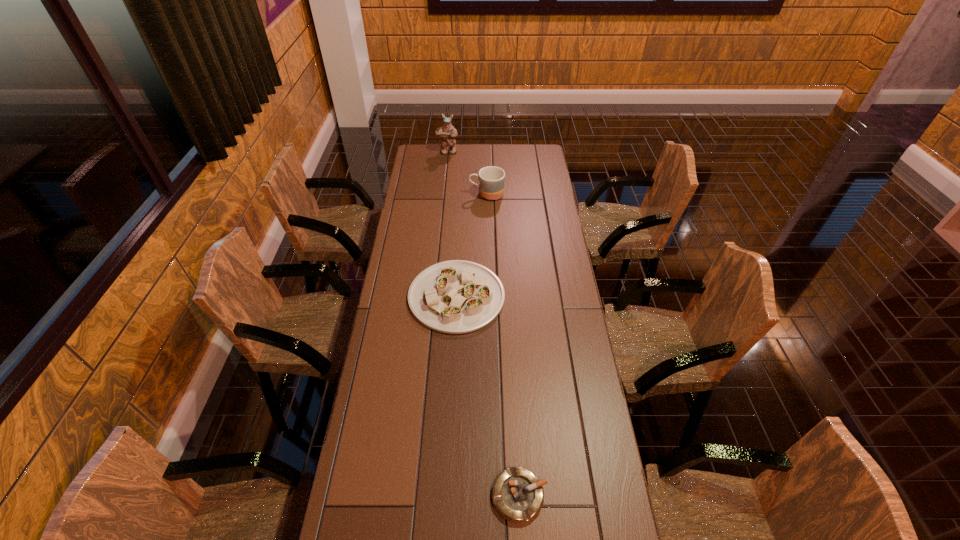
Identify the location of free location located 0.210m on the side with the handle of the mug. (426, 194).

At what (x,y) coordinates should I click in order to perform the action: click on free space located 0.070m on the side with the handle of the mug. Please return your answer as a coordinate pair (x, y). This screenshot has height=540, width=960. Looking at the image, I should click on (454, 194).

Where is `vacant space located on the back of the second nearest object`? The width and height of the screenshot is (960, 540). vacant space located on the back of the second nearest object is located at coordinates (461, 213).

Where is `vacant space situated 0.360m on the back of the shortest object`? vacant space situated 0.360m on the back of the shortest object is located at coordinates (512, 362).

Identify the location of object located in the far edge section of the desktop. The image size is (960, 540). (448, 133).

This screenshot has width=960, height=540. I want to click on figurine positioned at the left edge, so click(448, 133).

At what (x,y) coordinates should I click in order to perform the action: click on platter present at the left edge. Please return your answer as a coordinate pair (x, y). This screenshot has height=540, width=960. Looking at the image, I should click on (456, 296).

Locate an element on the screen. This screenshot has height=540, width=960. object at the far left corner is located at coordinates (448, 133).

The height and width of the screenshot is (540, 960). Find the location of `vacant space at the far edge of the desktop`. vacant space at the far edge of the desktop is located at coordinates (445, 166).

The height and width of the screenshot is (540, 960). In order to click on vacant space at the left edge in this screenshot , I will do `click(408, 199)`.